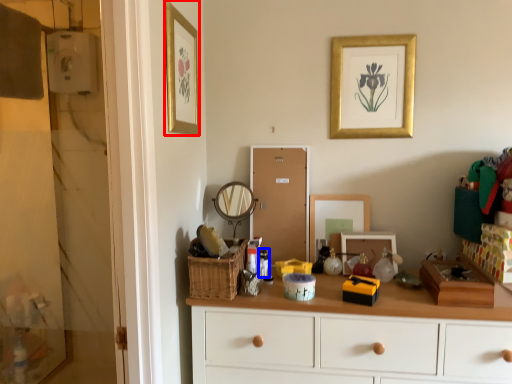
Question: Which object appears closest to the camera in this image, picture frame (highlighted by a red box) or toiletry (highlighted by a blue box)?

Choices:
 (A) picture frame
 (B) toiletry

Answer: (A)